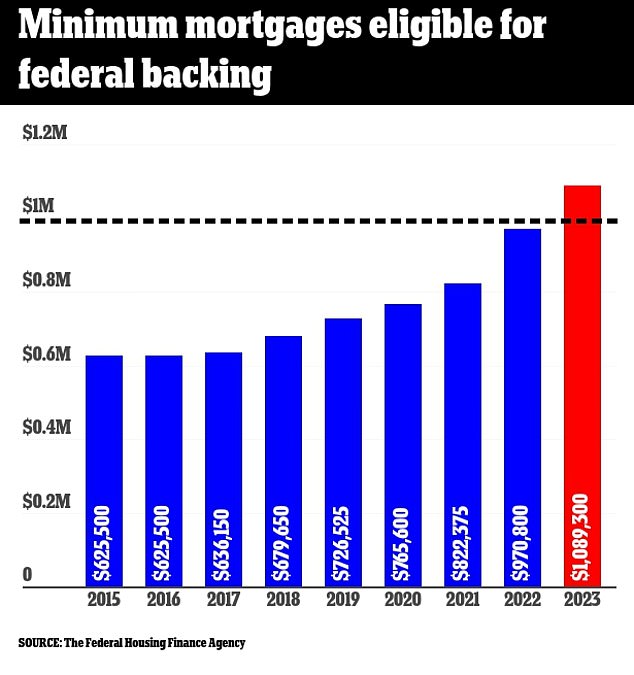
The height and width of the screenshot is (675, 634). Identify the location of blue columns. (110, 476), (163, 466), (215, 466), (288, 464), (328, 464), (399, 466), (469, 464), (534, 448).